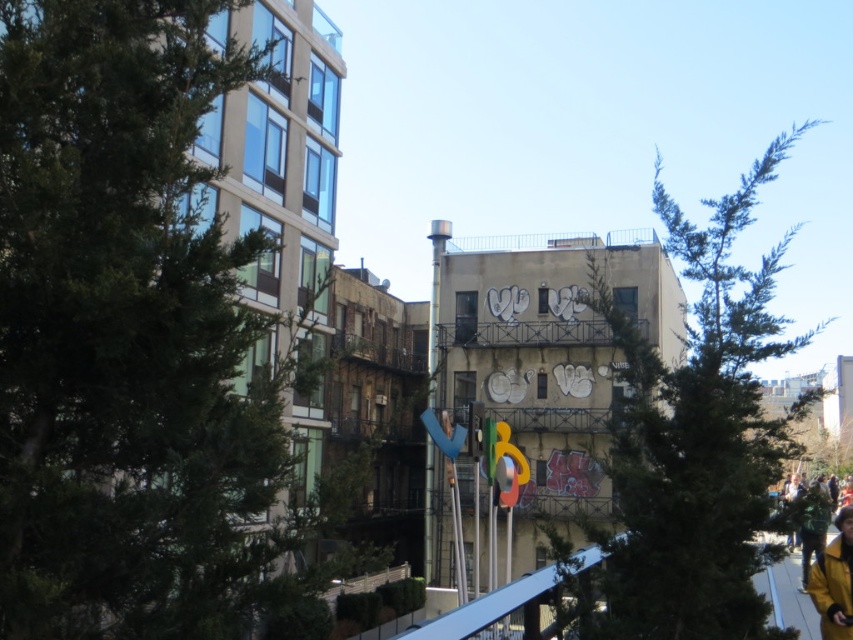
You are standing at point (132, 339) in the urban scene. What object is located exactly at this coordinate?

The green matte tree at left is located exactly at point (132, 339).